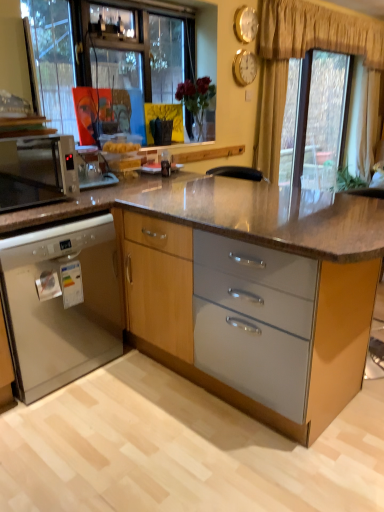
Question: From a real-world perspective, relative to matte wood cabinet at center, the 2th cabinetry from the left, is gold textured curtain at upper center vertically above or below?

Choices:
 (A) above
 (B) below

Answer: (A)

Question: From the image's perspective, is gold textured curtain at upper center positioned above or below matte wood cabinet at center, the 1th cabinetry in the right-to-left sequence?

Choices:
 (A) below
 (B) above

Answer: (B)

Question: Estimate the real-world distances between objects in this image. Which object is farther from the matte wood cabinet at center, the 2th cabinetry from the left?

Choices:
 (A) gold metallic clock at upper center, the first clock positioned from the top
 (B) gold textured curtain at upper center
 (C) satin black microwave at left
 (D) transparent glass window at upper right
 (E) white glossy dishwasher at lower left, which is the second cabinetry from right to left

Answer: (B)

Question: Estimate the real-world distances between objects in this image. Which object is closer to the gold textured curtain at upper center?

Choices:
 (A) white glossy dishwasher at lower left, which is counted as the 1th cabinetry, starting from the left
 (B) matte wood cabinet at center, the 2th cabinetry from the left
 (C) gold metallic clock at upper center, which ranks as the second clock in top-to-bottom order
 (D) transparent glass window at upper right
 (E) gold metallic clock at upper center, the first clock positioned from the top

Answer: (D)